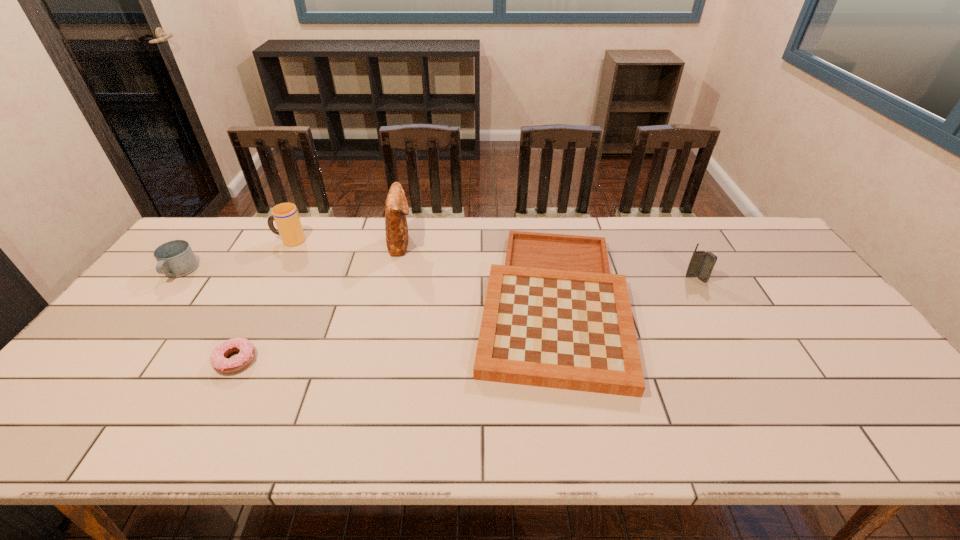
Where is `free area in between the second object from right to left and the doughnut`? free area in between the second object from right to left and the doughnut is located at coordinates (394, 332).

Locate an element on the screen. Image resolution: width=960 pixels, height=540 pixels. vacant area between the fifth object from left to right and the cup is located at coordinates (420, 272).

In order to click on free spot between the rightmost object and the doughnut in this screenshot , I will do `click(466, 320)`.

Find the location of `free space between the doughnut and the cellular telephone`. free space between the doughnut and the cellular telephone is located at coordinates (x=466, y=320).

Where is `vacant space in between the cup and the third shortest object`? The width and height of the screenshot is (960, 540). vacant space in between the cup and the third shortest object is located at coordinates (234, 256).

This screenshot has width=960, height=540. I want to click on free space between the clutch bag and the doughnut, so click(x=319, y=302).

You are a GUI agent. You are given a task and a screenshot of the screen. Output one action in this format:
    pyautogui.click(x=<x>, y=<y>)
    Task: Click on the empty location between the fourth object from left to right and the doughnut
    
    Given the screenshot: What is the action you would take?
    pyautogui.click(x=319, y=302)

What are the coordinates of `object identified as the closest to the doughnut` in the screenshot? It's located at [176, 258].

Identify which object is the nearest to the doughnut. Please provide its 2D coordinates. Your answer should be formatted as a tuple, i.e. [(x, y)], where the tuple contains the x and y coordinates of a point satisfying the conditions above.

[(176, 258)]

At what (x,y) coordinates should I click in order to perform the action: click on vacant region that satisfies the following two spatial constraints: 1. on the open side of the clutch bag; 2. on the right side of the fifth object from left to right. Please return your answer as a coordinate pair (x, y). Looking at the image, I should click on (388, 302).